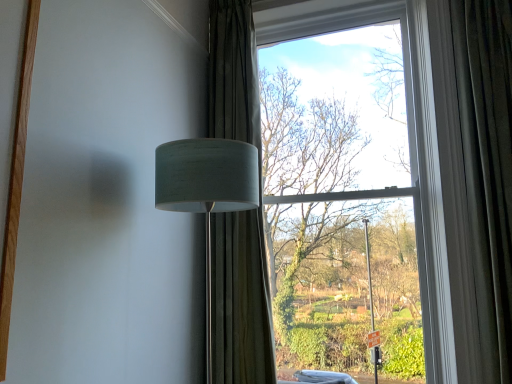
What is the approximate width of green textured curtain at center, marked as the 1th curtain in a left-to-right arrangement?

The width of green textured curtain at center, marked as the 1th curtain in a left-to-right arrangement, is 9.06 inches.

Where is `green textured curtain at center, the 2th curtain viewed from the right`? green textured curtain at center, the 2th curtain viewed from the right is located at coordinates (238, 212).

In order to face white fabric lampshade at left, should I rotate leftwards or rightwards?

You should look left and rotate roughly 5.890 degrees.

Find the location of a particular element. This screenshot has width=512, height=384. green textured curtain at center, marked as the 1th curtain in a left-to-right arrangement is located at coordinates (238, 212).

Based on the photo, from the image's perspective, is velvet dark green curtain at right, which is the first curtain from right to left, above or below green textured curtain at center, the 2th curtain viewed from the right?

Based on their image positions, velvet dark green curtain at right, which is the first curtain from right to left, is located beneath green textured curtain at center, the 2th curtain viewed from the right.

Is velvet dark green curtain at right, which is the first curtain from right to left, with green textured curtain at center, marked as the 1th curtain in a left-to-right arrangement?

No, velvet dark green curtain at right, which is the first curtain from right to left, is not in contact with green textured curtain at center, marked as the 1th curtain in a left-to-right arrangement.

Which object is positioned more to the left, velvet dark green curtain at right, which appears as the 2th curtain when viewed from the left, or green textured curtain at center, the 2th curtain viewed from the right?

green textured curtain at center, the 2th curtain viewed from the right, is more to the left.

Which of these two, clear glass window at center or white fabric lampshade at left, is thinner?

clear glass window at center.

Which of these two, clear glass window at center or white fabric lampshade at left, is smaller?

white fabric lampshade at left.

Is clear glass window at center taller or shorter than white fabric lampshade at left?

Considering their sizes, clear glass window at center has more height than white fabric lampshade at left.

This screenshot has height=384, width=512. I want to click on lamp below the clear glass window at center (from a real-world perspective), so click(206, 191).

Are velvet dark green curtain at right, which is the first curtain from right to left, and white fabric lampshade at left making contact?

No.

Locate an element on the screen. This screenshot has height=384, width=512. the 1st curtain behind the white fabric lampshade at left, starting your count from the anchor is located at coordinates (478, 173).

How much distance is there between velvet dark green curtain at right, which appears as the 2th curtain when viewed from the left, and white fabric lampshade at left?

The distance of velvet dark green curtain at right, which appears as the 2th curtain when viewed from the left, from white fabric lampshade at left is 3.72 feet.

Is velvet dark green curtain at right, which is the first curtain from right to left, positioned with its back to white fabric lampshade at left?

velvet dark green curtain at right, which is the first curtain from right to left, does not have its back to white fabric lampshade at left.

Looking at this image, measure the distance between white fabric lampshade at left and clear glass window at center.

white fabric lampshade at left is 3.80 feet from clear glass window at center.

The image size is (512, 384). I want to click on window that appears behind the white fabric lampshade at left, so click(408, 136).

Is white fabric lampshade at left wider or thinner than clear glass window at center?

In the image, white fabric lampshade at left appears to be wider than clear glass window at center.

Considering their positions, is white fabric lampshade at left located in front of or behind clear glass window at center?

Clearly, white fabric lampshade at left is in front of clear glass window at center.

Considering the relative sizes of green textured curtain at center, marked as the 1th curtain in a left-to-right arrangement, and velvet dark green curtain at right, which is the first curtain from right to left, in the image provided, is green textured curtain at center, marked as the 1th curtain in a left-to-right arrangement, shorter than velvet dark green curtain at right, which is the first curtain from right to left,?

No, green textured curtain at center, marked as the 1th curtain in a left-to-right arrangement, is not shorter than velvet dark green curtain at right, which is the first curtain from right to left.

Could you tell me if green textured curtain at center, the 2th curtain viewed from the right, is turned towards velvet dark green curtain at right, which appears as the 2th curtain when viewed from the left?

No, green textured curtain at center, the 2th curtain viewed from the right, is not oriented towards velvet dark green curtain at right, which appears as the 2th curtain when viewed from the left.

Does green textured curtain at center, the 2th curtain viewed from the right, have a greater width compared to velvet dark green curtain at right, which appears as the 2th curtain when viewed from the left?

Correct, the width of green textured curtain at center, the 2th curtain viewed from the right, exceeds that of velvet dark green curtain at right, which appears as the 2th curtain when viewed from the left.

Considering the positions of objects green textured curtain at center, marked as the 1th curtain in a left-to-right arrangement, and velvet dark green curtain at right, which appears as the 2th curtain when viewed from the left, in the image provided, who is more to the right, green textured curtain at center, marked as the 1th curtain in a left-to-right arrangement, or velvet dark green curtain at right, which appears as the 2th curtain when viewed from the left,?

From the viewer's perspective, velvet dark green curtain at right, which appears as the 2th curtain when viewed from the left, appears more on the right side.

Is velvet dark green curtain at right, which is the first curtain from right to left, facing away from clear glass window at center?

That's not correct — velvet dark green curtain at right, which is the first curtain from right to left, is not looking away from clear glass window at center.

Is velvet dark green curtain at right, which appears as the 2th curtain when viewed from the left, taller than clear glass window at center?

No, velvet dark green curtain at right, which appears as the 2th curtain when viewed from the left, is not taller than clear glass window at center.

Based on their sizes in the image, would you say velvet dark green curtain at right, which appears as the 2th curtain when viewed from the left, is bigger or smaller than clear glass window at center?

Clearly, velvet dark green curtain at right, which appears as the 2th curtain when viewed from the left, is smaller in size than clear glass window at center.

How far apart are velvet dark green curtain at right, which is the first curtain from right to left, and clear glass window at center?

A distance of 9.40 inches exists between velvet dark green curtain at right, which is the first curtain from right to left, and clear glass window at center.

In the image, there is a clear glass window at center. Find the location of `curtain below it (from a real-world perspective)`. curtain below it (from a real-world perspective) is located at coordinates (478, 173).

Is point (298, 8) less distant than point (452, 27)?

No, (298, 8) is further to viewer.

From a real-world perspective, is clear glass window at center beneath velvet dark green curtain at right, which is the first curtain from right to left?

Actually, clear glass window at center is physically above velvet dark green curtain at right, which is the first curtain from right to left, in the real world.

Is clear glass window at center looking in the opposite direction of velvet dark green curtain at right, which appears as the 2th curtain when viewed from the left?

That's not correct — clear glass window at center is not looking away from velvet dark green curtain at right, which appears as the 2th curtain when viewed from the left.

Image resolution: width=512 pixels, height=384 pixels. Identify the location of curtain above the velvet dark green curtain at right, which is the first curtain from right to left (from a real-world perspective). (238, 212).

Where is `window located above the white fabric lampshade at left (from the image's perspective)`? The height and width of the screenshot is (384, 512). window located above the white fabric lampshade at left (from the image's perspective) is located at coordinates (408, 136).

From the image, which object appears to be nearer to white fabric lampshade at left, green textured curtain at center, the 2th curtain viewed from the right, or velvet dark green curtain at right, which is the first curtain from right to left?

green textured curtain at center, the 2th curtain viewed from the right, is closer to white fabric lampshade at left.

From the image, which object appears to be farther from clear glass window at center, white fabric lampshade at left or velvet dark green curtain at right, which appears as the 2th curtain when viewed from the left?

white fabric lampshade at left is positioned further to the anchor clear glass window at center.

From the image, which object appears to be farther from velvet dark green curtain at right, which is the first curtain from right to left, clear glass window at center or green textured curtain at center, marked as the 1th curtain in a left-to-right arrangement?

Among the two, green textured curtain at center, marked as the 1th curtain in a left-to-right arrangement, is located further to velvet dark green curtain at right, which is the first curtain from right to left.

When comparing their distances from white fabric lampshade at left, does clear glass window at center or velvet dark green curtain at right, which appears as the 2th curtain when viewed from the left, seem further?

Based on the image, clear glass window at center appears to be further to white fabric lampshade at left.

Looking at the image, which one is located closer to white fabric lampshade at left, velvet dark green curtain at right, which is the first curtain from right to left, or green textured curtain at center, marked as the 1th curtain in a left-to-right arrangement?

green textured curtain at center, marked as the 1th curtain in a left-to-right arrangement, is positioned closer to the anchor white fabric lampshade at left.

Looking at the image, which one is located further to velvet dark green curtain at right, which appears as the 2th curtain when viewed from the left, green textured curtain at center, the 2th curtain viewed from the right, or clear glass window at center?

Among the two, green textured curtain at center, the 2th curtain viewed from the right, is located further to velvet dark green curtain at right, which appears as the 2th curtain when viewed from the left.

When comparing their distances from white fabric lampshade at left, does green textured curtain at center, marked as the 1th curtain in a left-to-right arrangement, or clear glass window at center seem further?

clear glass window at center.

Estimate the real-world distances between objects in this image. Which object is further from clear glass window at center, velvet dark green curtain at right, which appears as the 2th curtain when viewed from the left, or green textured curtain at center, marked as the 1th curtain in a left-to-right arrangement?

green textured curtain at center, marked as the 1th curtain in a left-to-right arrangement.

You are a GUI agent. You are given a task and a screenshot of the screen. Output one action in this format:
    pyautogui.click(x=<x>, y=<y>)
    Task: Click on the curtain between white fabric lampshade at left and velvet dark green curtain at right, which is the first curtain from right to left, in the horizontal direction
    The width and height of the screenshot is (512, 384).
    Given the screenshot: What is the action you would take?
    pyautogui.click(x=238, y=212)

Image resolution: width=512 pixels, height=384 pixels. What are the coordinates of `window between white fabric lampshade at left and velvet dark green curtain at right, which appears as the 2th curtain when viewed from the left, from left to right` in the screenshot? It's located at (408, 136).

At what (x,y) coordinates should I click in order to perform the action: click on window between white fabric lampshade at left and green textured curtain at center, marked as the 1th curtain in a left-to-right arrangement, along the z-axis. Please return your answer as a coordinate pair (x, y). The image size is (512, 384). Looking at the image, I should click on (408, 136).

Where is `window between green textured curtain at center, the 2th curtain viewed from the right, and velvet dark green curtain at right, which is the first curtain from right to left`? The image size is (512, 384). window between green textured curtain at center, the 2th curtain viewed from the right, and velvet dark green curtain at right, which is the first curtain from right to left is located at coordinates (408, 136).